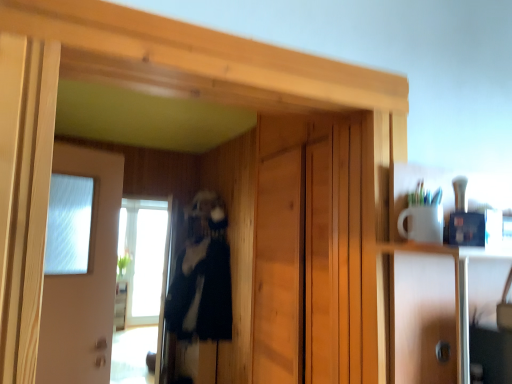
Question: Considering the positions of transparent glass window at center and white glossy door at left in the image, is transparent glass window at center wider or thinner than white glossy door at left?

Choices:
 (A) thin
 (B) wide

Answer: (B)

Question: Considering the positions of transparent glass window at center and white glossy door at left in the image, is transparent glass window at center taller or shorter than white glossy door at left?

Choices:
 (A) tall
 (B) short

Answer: (A)

Question: Which of these objects is positioned closest to the transparent glass window at center?

Choices:
 (A) white glossy door at left
 (B) black fuzzy coat at center
 (C) transparent glass screen door at left

Answer: (C)

Question: Estimate the real-world distances between objects in this image. Which object is closer to the white glossy door at left?

Choices:
 (A) transparent glass window at center
 (B) transparent glass screen door at left
 (C) black fuzzy coat at center

Answer: (C)